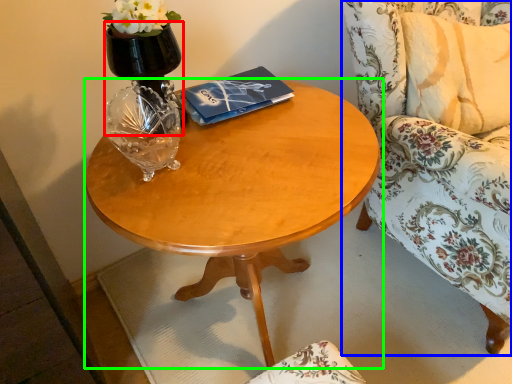
Question: Which object is the closest to the vase (highlighted by a red box)? Choose among these: chair (highlighted by a blue box) or coffee table (highlighted by a green box).

Choices:
 (A) chair
 (B) coffee table

Answer: (B)